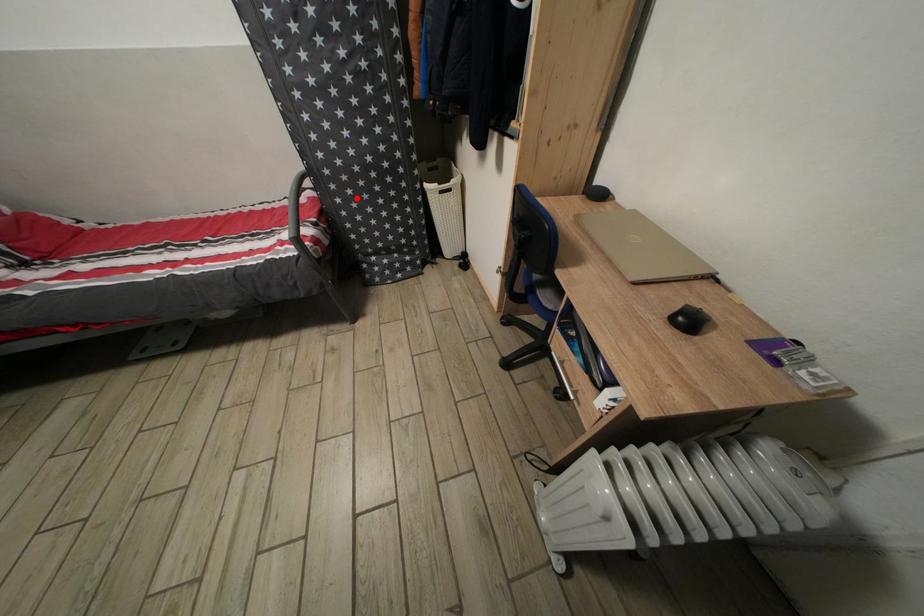
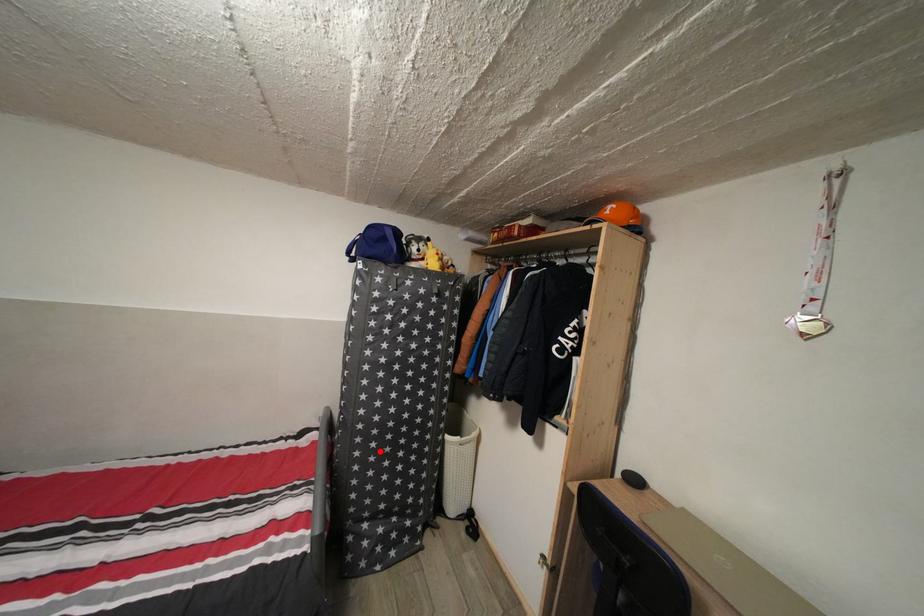
Consider the image. I am providing you with two images of the same scene from different viewpoints. A red point is marked on the first image and another point is marked on the second image. Are the points marked in image1 and image2 representing the same 3D position?

Yes